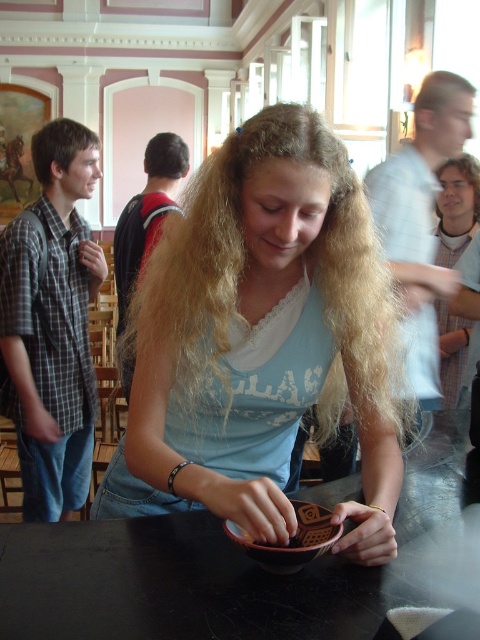
Question: Does blonde hair at upper left appear over blonde hair at upper center?

Choices:
 (A) yes
 (B) no

Answer: (A)

Question: Is matte brown bowl at center positioned behind plaid shirt at left?

Choices:
 (A) yes
 (B) no

Answer: (B)

Question: Is brown straight hair at left below blonde hair at upper center?

Choices:
 (A) yes
 (B) no

Answer: (A)

Question: Which point is closer to the camera taking this photo?

Choices:
 (A) (469, 182)
 (B) (300, 513)
 (C) (27, 550)

Answer: (B)

Question: Estimate the real-world distances between objects in this image. Which object is farther from the plaid shirt at left?

Choices:
 (A) black backpack at upper left
 (B) black glossy table at center
 (C) blonde hair at upper center

Answer: (C)

Question: Which point is closer to the camera?

Choices:
 (A) (444, 72)
 (B) (154, 220)
 (C) (475, 198)

Answer: (A)